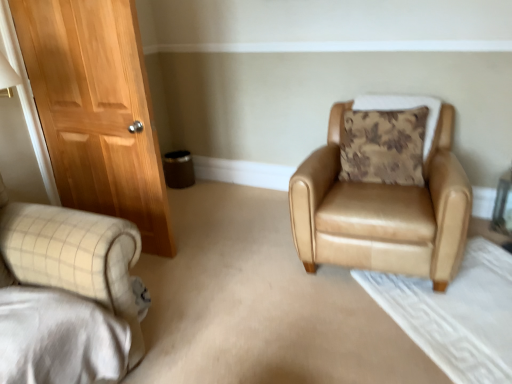
The width and height of the screenshot is (512, 384). Find the location of `free region on the left part of tan leather armchair at center-right`. free region on the left part of tan leather armchair at center-right is located at coordinates (238, 266).